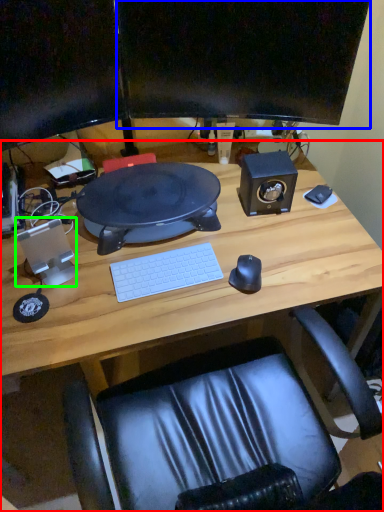
Question: Based on their relative distances, which object is farther from desk (highlighted by a red box)? Choose from computer monitor (highlighted by a blue box) and speaker (highlighted by a green box).

Choices:
 (A) computer monitor
 (B) speaker

Answer: (A)